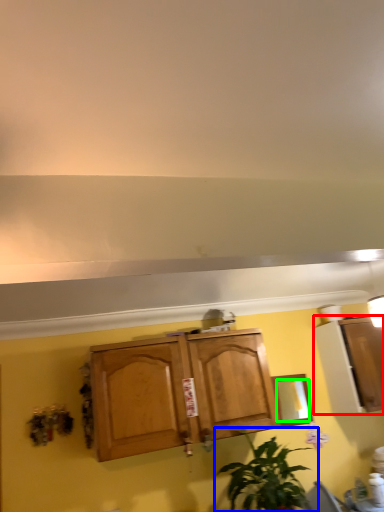
Question: Based on their relative distances, which object is nearer to cabinetry (highlighted by a red box)? Choose from houseplant (highlighted by a blue box) and mirror (highlighted by a green box).

Choices:
 (A) houseplant
 (B) mirror

Answer: (B)